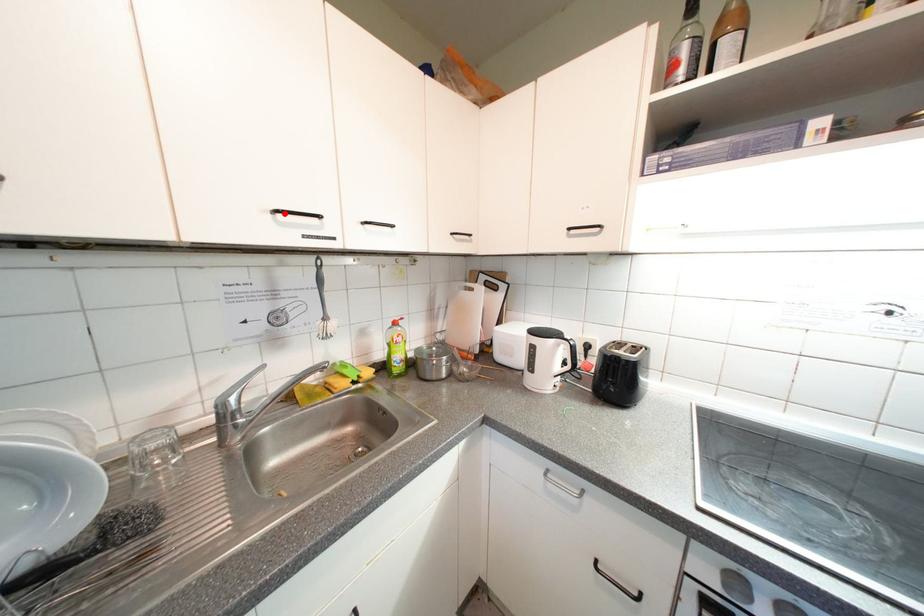
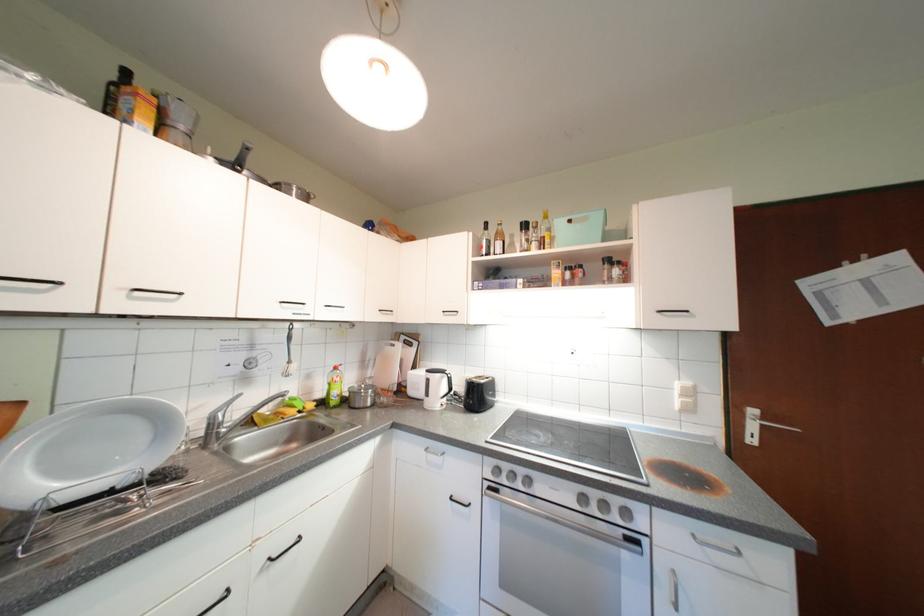
The point at the highlighted location is marked in the first image. Where is the corresponding point in the second image?

(292, 305)